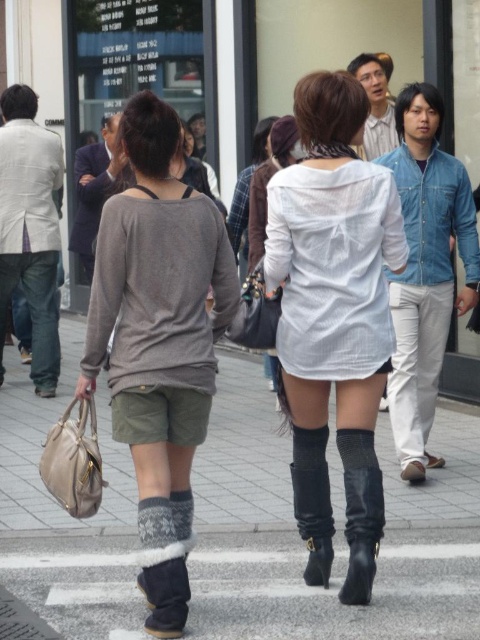
Between point (291, 364) and point (16, 376), which one is positioned behind?

The point (16, 376) is behind.

Can you confirm if white textured shirt at center is positioned to the left of gray concrete pavement at center?

No, white textured shirt at center is not to the left of gray concrete pavement at center.

Does point (367, 291) come behind point (128, 497)?

No, it is not.

Locate an element on the screen. white textured shirt at center is located at coordinates (334, 317).

Consider the image. How distant is gray concrete pavement at center from black leather boot at lower center?

A distance of 9.29 feet exists between gray concrete pavement at center and black leather boot at lower center.

Is point (433, 445) farther from camera compared to point (356, 481)?

Yes, point (433, 445) is farther from viewer.

Does point (90, 531) come farther from viewer compared to point (356, 556)?

Yes, it is.

You are a GUI agent. You are given a task and a screenshot of the screen. Output one action in this format:
    pyautogui.click(x=<x>, y=<y>)
    Task: Click on the gray concrete pavement at center
    
    Given the screenshot: What is the action you would take?
    pyautogui.click(x=241, y=452)

Between gray woolen sweater at center and black leather boot at lower center, which one appears on the left side from the viewer's perspective?

gray woolen sweater at center is more to the left.

Describe the element at coordinates (158, 340) in the screenshot. I see `gray woolen sweater at center` at that location.

You are a GUI agent. You are given a task and a screenshot of the screen. Output one action in this format:
    pyautogui.click(x=<x>, y=<y>)
    Task: Click on the gray woolen sweater at center
    
    Given the screenshot: What is the action you would take?
    pyautogui.click(x=158, y=340)